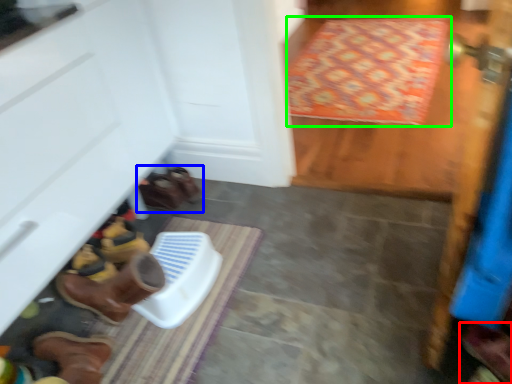
Question: Which object is the closest to the footwear (highlighted by a red box)? Choose among these: footwear (highlighted by a blue box) or doormat (highlighted by a green box).

Choices:
 (A) footwear
 (B) doormat

Answer: (A)